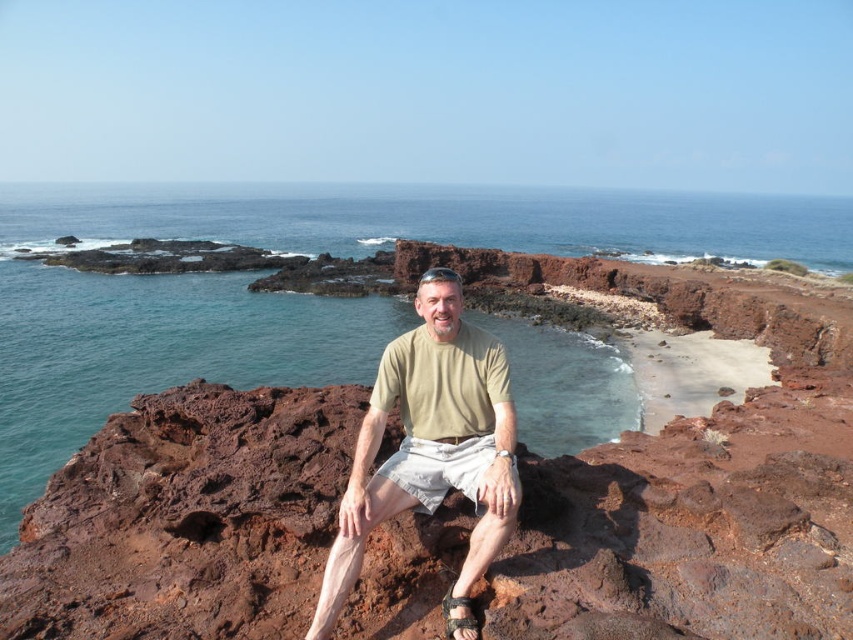
Who is higher up, clear blue water at center or light brown cotton shirt at center?

Positioned higher is clear blue water at center.

Does point (375, 211) come farther from viewer compared to point (463, 429)?

Yes.

What are the coordinates of `clear blue water at center` in the screenshot? It's located at (296, 292).